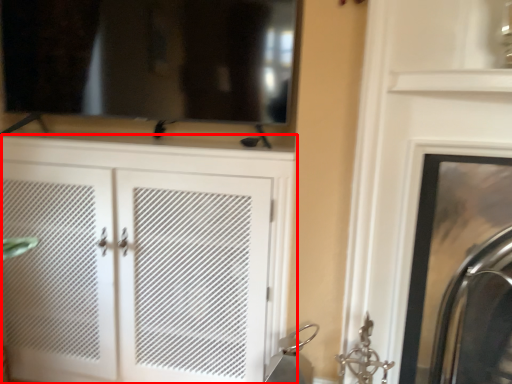
Question: From the image, what is the correct spatial relationship of cupboard (annotated by the red box) in relation to fireplace?

Choices:
 (A) left
 (B) right

Answer: (A)